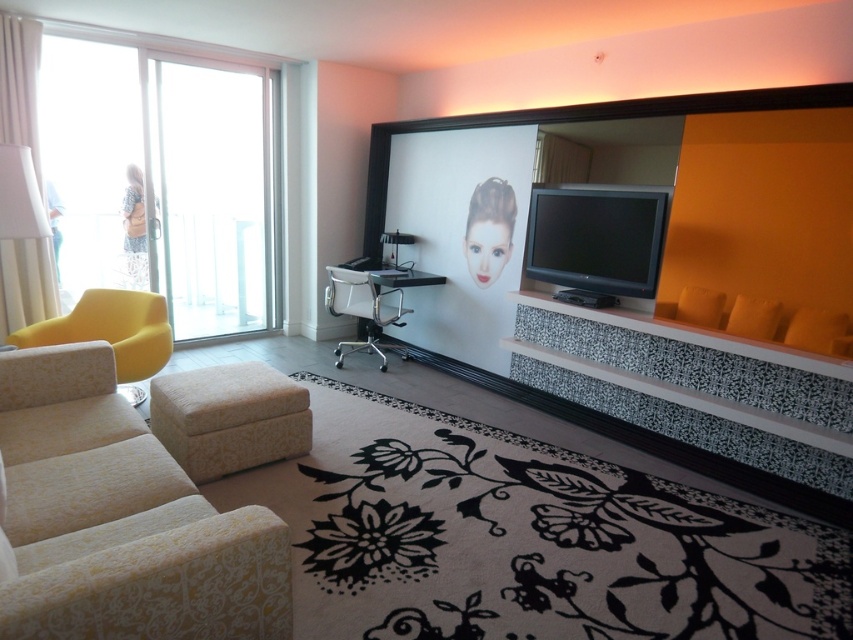
Locate an element on the screen. The image size is (853, 640). yellow fabric chair at left is located at coordinates (111, 332).

Who is shorter, yellow fabric chair at left or white mesh office chair at center?

With less height is yellow fabric chair at left.

Is point (154, 308) in front of point (378, 320)?

Yes, it is.

This screenshot has height=640, width=853. Find the location of `yellow fabric chair at left`. yellow fabric chair at left is located at coordinates (111, 332).

Between beige floral fabric couch at lower left and floral fabric ottoman at center, which one appears on the left side from the viewer's perspective?

beige floral fabric couch at lower left

Describe the element at coordinates (120, 518) in the screenshot. Image resolution: width=853 pixels, height=640 pixels. I see `beige floral fabric couch at lower left` at that location.

Where is `beige floral fabric couch at lower left`? This screenshot has height=640, width=853. beige floral fabric couch at lower left is located at coordinates (120, 518).

Can you confirm if transparent glass door at left is smaller than floral fabric ottoman at center?

No, transparent glass door at left is not smaller than floral fabric ottoman at center.

Measure the distance between point (194, 243) and camera.

18.13 feet

The width and height of the screenshot is (853, 640). Find the location of `transparent glass door at left`. transparent glass door at left is located at coordinates (213, 196).